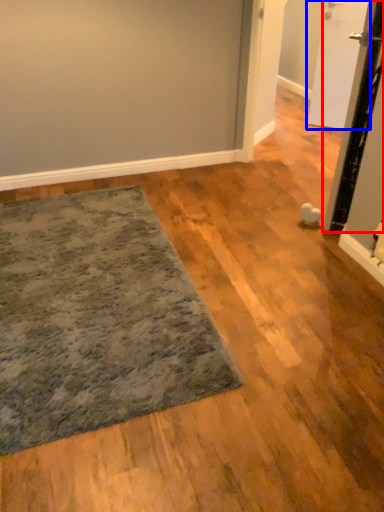
Question: Which point is closer to the camera, door (highlighted by a red box) or door (highlighted by a blue box)?

Choices:
 (A) door
 (B) door

Answer: (A)